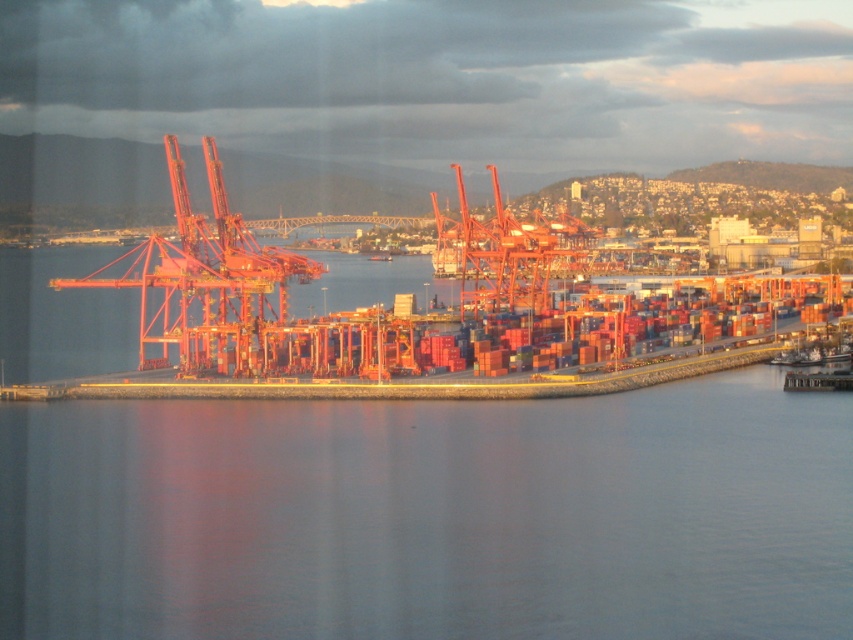
You are a port worker who needs to cross from the dock to the ship. The transparent water at lower center and the metallic orange crane at center are in your path. Which one do you need to avoid stepping on?

You should avoid stepping on the transparent water at lower center because it has a larger size compared to the metallic orange crane at center, making it more likely to be a body of water that you cannot walk on.

You are a crane operator who needs to lower a heavy container onto a ship. You see the transparent water at lower center and the metallic orange crane at center. Which object is positioned lower in the scene?

The transparent water at lower center is located below the metallic orange crane at center, so it is positioned lower in the scene.

You are standing at the port and want to take a photo of both point (x=3, y=472) and point (x=460, y=272). Which point will appear larger in your photo?

Point (x=3, y=472) is closer to the camera than point (x=460, y=272), so it will appear larger in the photo.